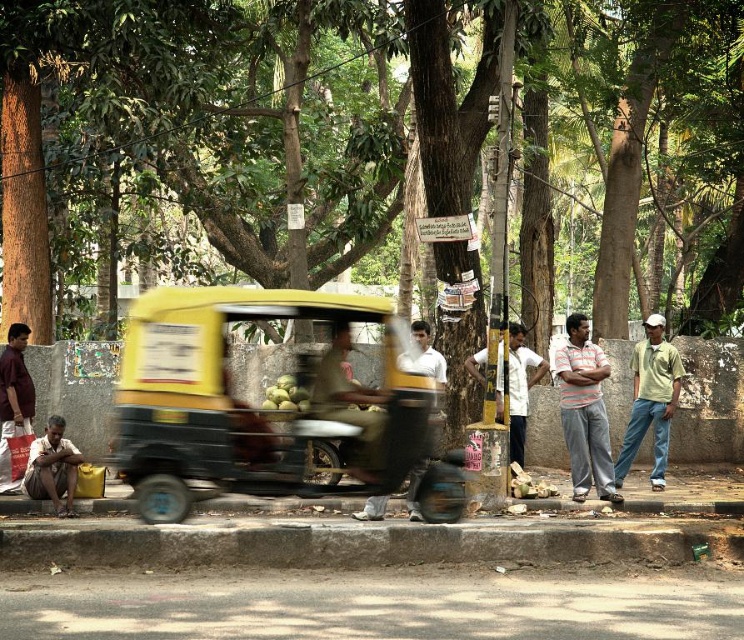
Is green leafy tree at center bigger than yellow matte auto-rickshaw at center?

Yes.

Who is more distant from viewer, [536,275] or [243,413]?

Positioned behind is point [536,275].

Find the location of a particular element. Image resolution: width=744 pixels, height=640 pixels. green leafy tree at center is located at coordinates (227, 134).

Is concrete curb at lower center positioned behind white shirt at center?

No, it is in front of white shirt at center.

Based on the photo, can you confirm if concrete curb at lower center is thinner than white shirt at center?

No, concrete curb at lower center is not thinner than white shirt at center.

Is point (355, 502) closer to camera compared to point (516, 401)?

Yes, it is in front of point (516, 401).

This screenshot has height=640, width=744. In order to click on concrete curb at lower center in this screenshot , I will do `click(684, 506)`.

Does striped cotton shirt at center appear under white shirt at center?

Correct, striped cotton shirt at center is located below white shirt at center.

Which is below, striped cotton shirt at center or white shirt at center?

striped cotton shirt at center is below.

Locate an element on the screen. striped cotton shirt at center is located at coordinates (583, 412).

Where is `striped cotton shirt at center`? striped cotton shirt at center is located at coordinates (583, 412).